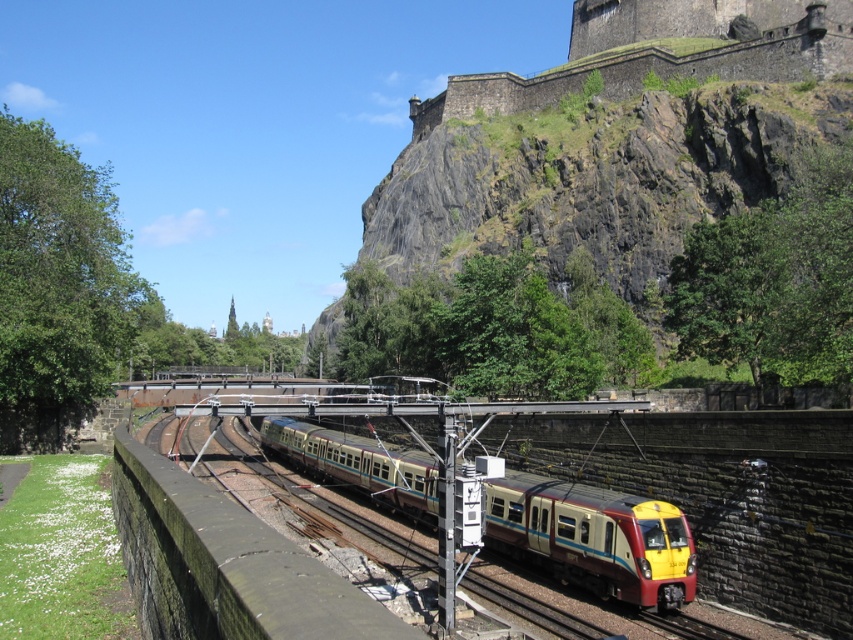
Question: Does yellow polished metal train at center have a lesser width compared to dark stone wall at upper center?

Choices:
 (A) no
 (B) yes

Answer: (B)

Question: Which point is farther to the camera?

Choices:
 (A) dark stone wall at upper center
 (B) yellow polished metal train at center

Answer: (A)

Question: Is yellow polished metal train at center above dark stone wall at upper center?

Choices:
 (A) yes
 (B) no

Answer: (B)

Question: Is yellow polished metal train at center bigger than dark stone wall at upper center?

Choices:
 (A) no
 (B) yes

Answer: (A)

Question: Among these objects, which one is nearest to the camera?

Choices:
 (A) yellow polished metal train at center
 (B) dark stone wall at upper center

Answer: (A)